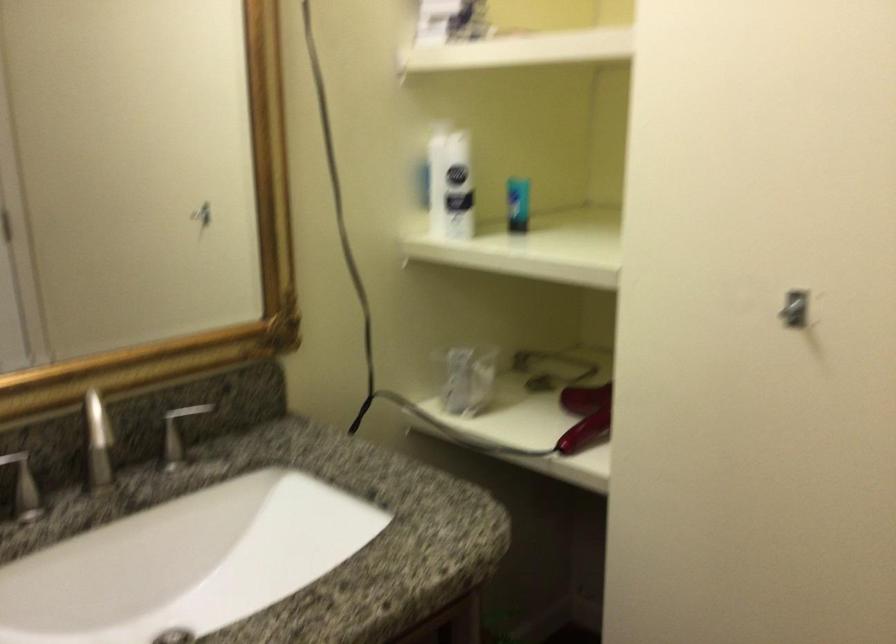
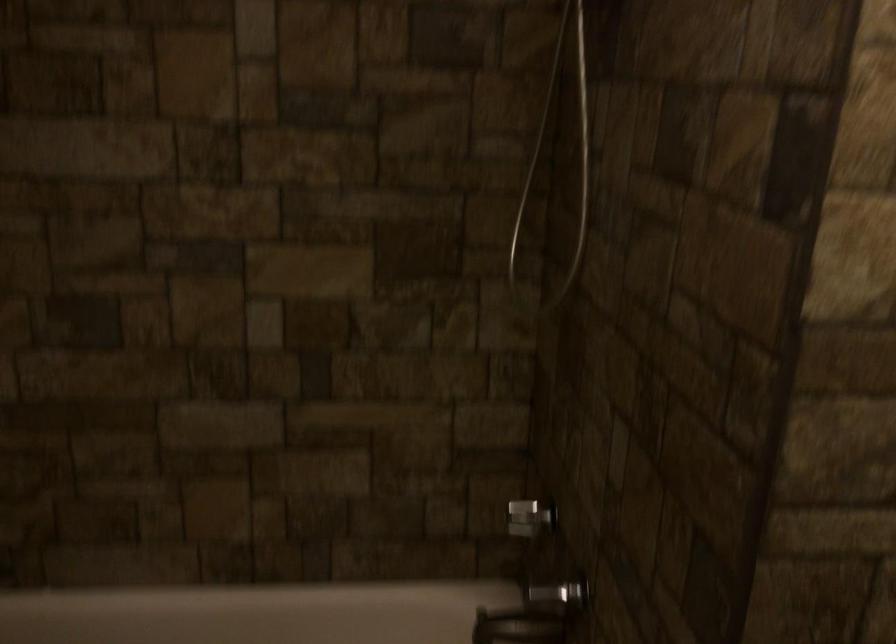
Question: Based on the continuous images, in which direction is the camera rotating? Reply with the corresponding letter.

Choices:
 (A) Left
 (B) Right
 (C) Up
 (D) Down

Answer: (A)